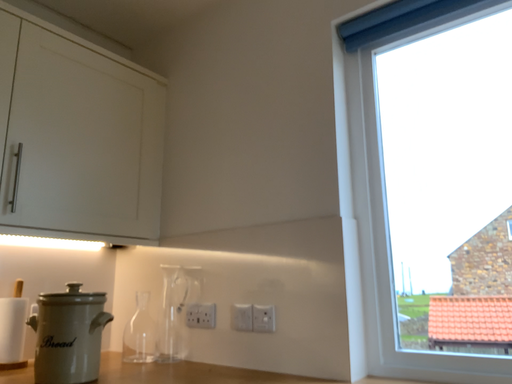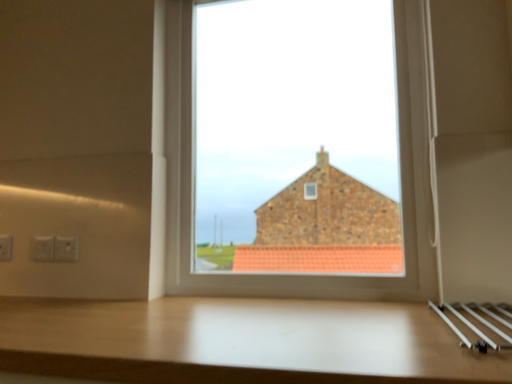
Question: How did the camera likely rotate when shooting the video?

Choices:
 (A) rotated right
 (B) rotated left

Answer: (A)